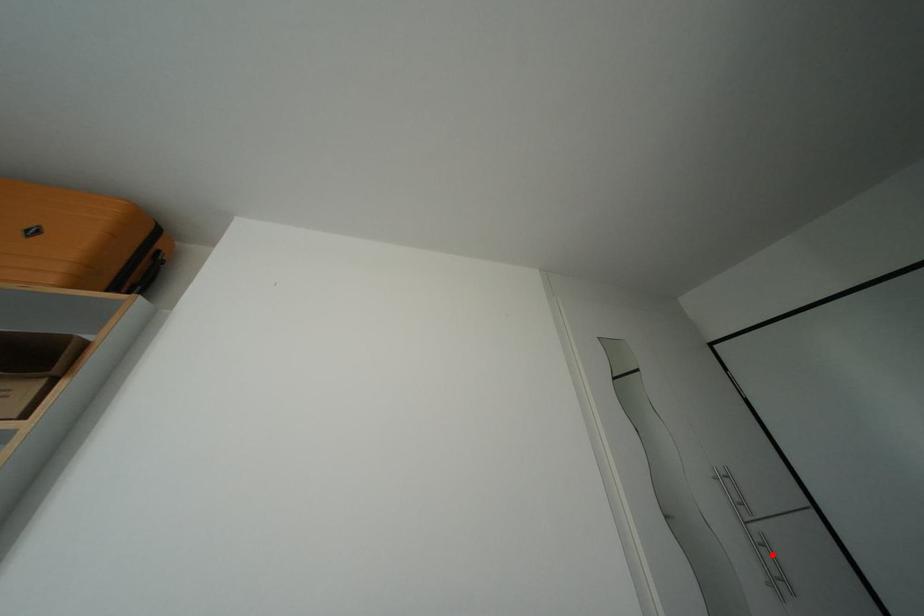
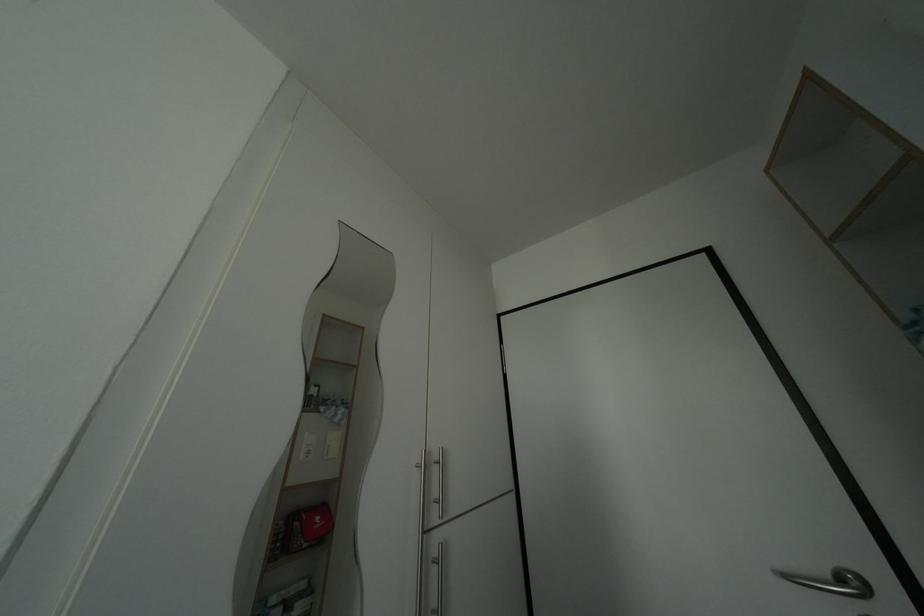
Locate, in the second image, the point that corresponds to the highlighted location in the first image.

(442, 576)